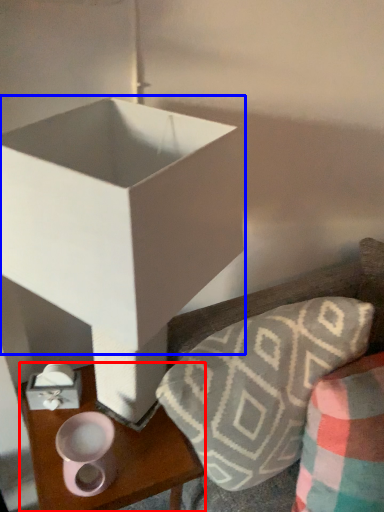
Question: Which of the following is the farthest to the observer, table (highlighted by a red box) or box (highlighted by a blue box)?

Choices:
 (A) table
 (B) box

Answer: (A)